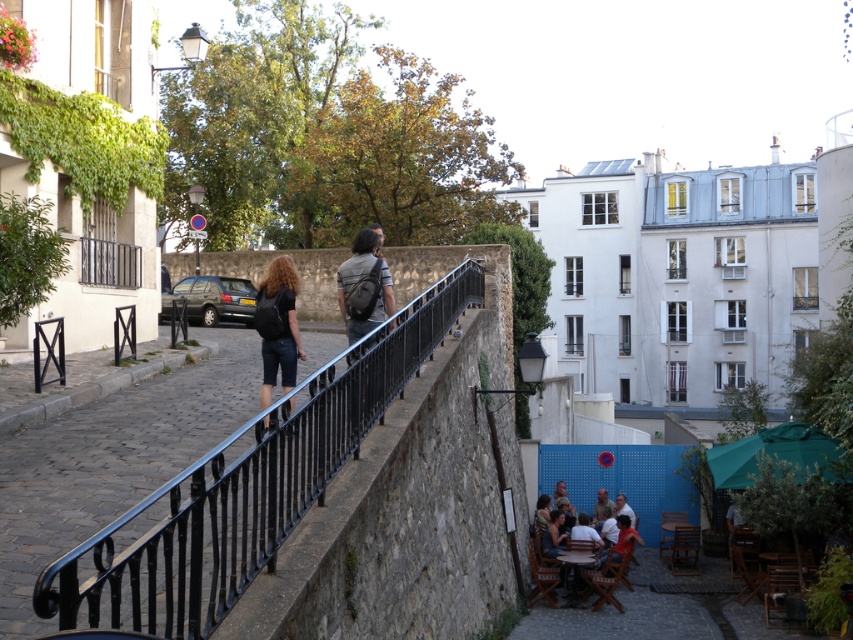
Question: Is black wrought iron railing at center above smooth skin face at lower center?

Choices:
 (A) yes
 (B) no

Answer: (A)

Question: Which point is closer to the camera?

Choices:
 (A) smooth skin face at lower center
 (B) black wrought iron railing at center
 (C) black matte backpack at center

Answer: (B)

Question: Does light brown wooden chair at lower right have a larger size compared to smooth skin face at lower center?

Choices:
 (A) yes
 (B) no

Answer: (A)

Question: Is black wrought iron railing at center bigger than matte gray backpack at center?

Choices:
 (A) yes
 (B) no

Answer: (A)

Question: Based on their relative distances, which object is nearer to the smooth skin face at lower center?

Choices:
 (A) black matte backpack at center
 (B) light brown wooden chair at lower right
 (C) matte gray backpack at center

Answer: (B)

Question: Which point is closer to the camera taking this photo?

Choices:
 (A) (595, 515)
 (B) (372, 257)

Answer: (B)